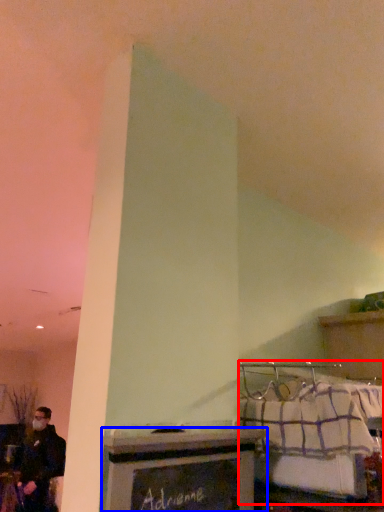
Question: Which object appears farthest to the camera in this image, bed (highlighted by a red box) or furniture (highlighted by a blue box)?

Choices:
 (A) bed
 (B) furniture

Answer: (A)